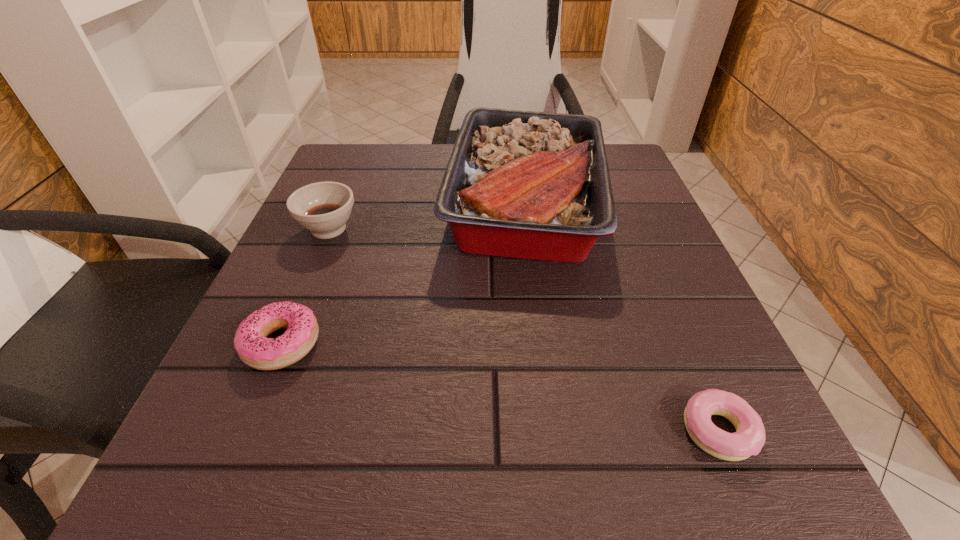
Identify the location of free space between the taller doughnut and the nearest object. (499, 388).

Find the location of a particular element. free space between the shortest object and the third shortest object is located at coordinates (523, 330).

Image resolution: width=960 pixels, height=540 pixels. What are the coordinates of `empty location between the soup bowl and the right doughnut` in the screenshot? It's located at (523, 330).

Locate which object ranks third in proximity to the shortest object. Please provide its 2D coordinates. Your answer should be formatted as a tuple, i.e. [(x, y)], where the tuple contains the x and y coordinates of a point satisfying the conditions above.

[(323, 208)]

Where is `the third closest object to the taller doughnut`? Image resolution: width=960 pixels, height=540 pixels. the third closest object to the taller doughnut is located at coordinates (749, 438).

You are a GUI agent. You are given a task and a screenshot of the screen. Output one action in this format:
    pyautogui.click(x=<x>, y=<y>)
    Task: Click on the free spot that satisfies the following two spatial constraints: 1. on the front side of the nearest object; 2. on the left side of the soup bowl
    The height and width of the screenshot is (540, 960).
    Given the screenshot: What is the action you would take?
    pyautogui.click(x=245, y=431)

Where is `free space that satisfies the following two spatial constraints: 1. on the front side of the third shortest object; 2. on the right side of the left doughnut`? free space that satisfies the following two spatial constraints: 1. on the front side of the third shortest object; 2. on the right side of the left doughnut is located at coordinates (281, 343).